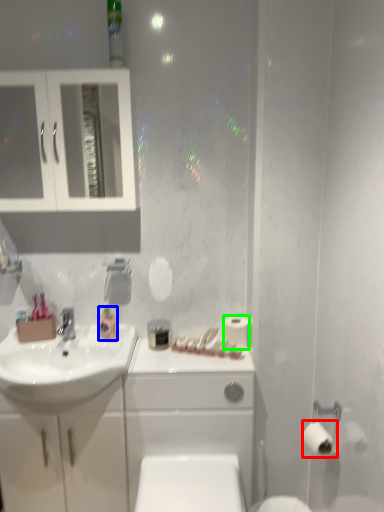
Question: Which is farther away from toilet paper (highlighted by a red box)? mouthwash (highlighted by a blue box) or toilet paper (highlighted by a green box)?

Choices:
 (A) mouthwash
 (B) toilet paper

Answer: (A)